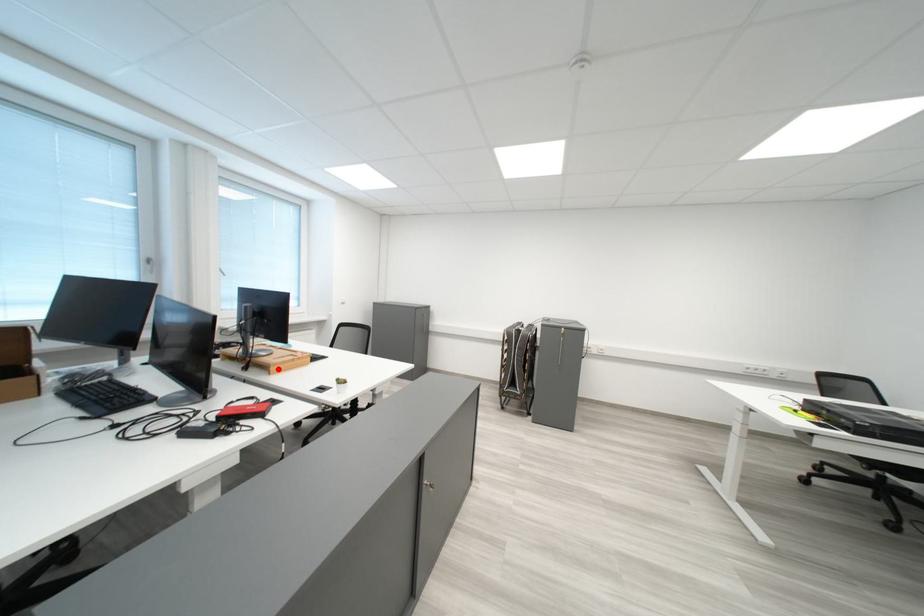
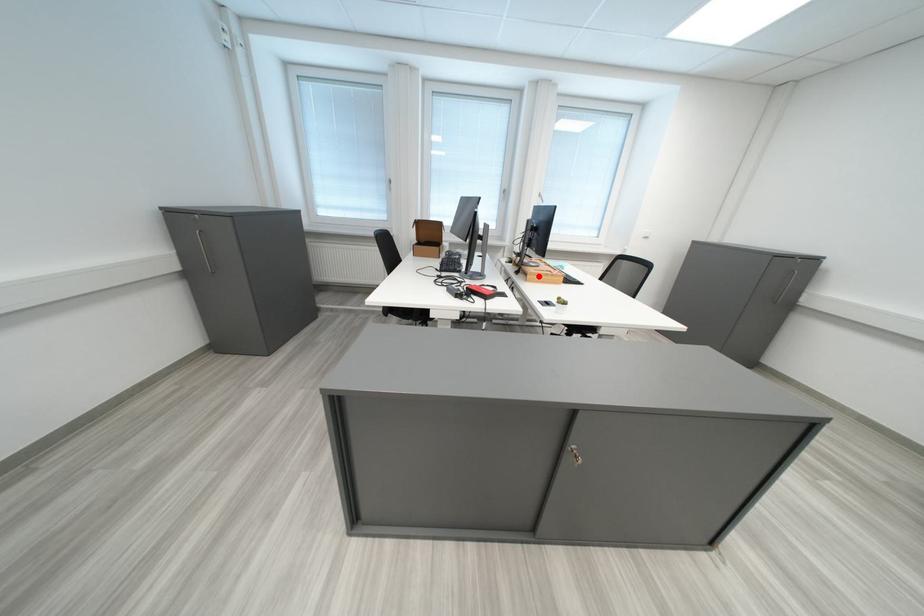
I am providing you with two images of the same scene from different viewpoints. A red point is marked on the first image and another point is marked on the second image. Does the point marked in image1 correspond to the same location as the one in image2?

Yes